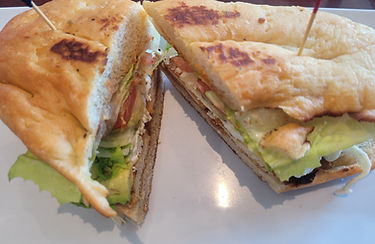
You are a GUI agent. You are given a task and a screenshot of the screen. Output one action in this format:
    pyautogui.click(x=<x>, y=<y>)
    Task: Click on the back wall
    This screenshot has height=244, width=375.
    Given the screenshot: What is the action you would take?
    pyautogui.click(x=10, y=2), pyautogui.click(x=280, y=2), pyautogui.click(x=340, y=3)